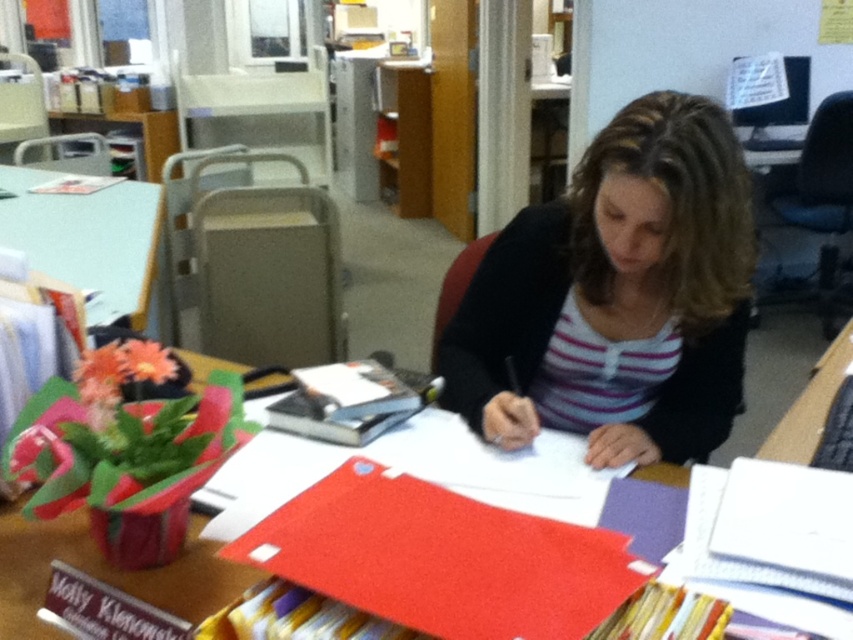
Question: Which point appears closest to the camera in this image?

Choices:
 (A) (802, 419)
 (B) (413, 380)

Answer: (A)

Question: Is the position of striped knit sweater at center less distant than that of green plastic table at upper left?

Choices:
 (A) yes
 (B) no

Answer: (A)

Question: From the image, what is the correct spatial relationship of green plastic table at upper left in relation to hardcover book at center?

Choices:
 (A) below
 (B) above

Answer: (B)

Question: Does white paper at center appear on the right side of green plastic table at upper left?

Choices:
 (A) yes
 (B) no

Answer: (A)

Question: Which of these objects is positioned closest to the hardcover book at center?

Choices:
 (A) green plastic table at upper left
 (B) white paper at center

Answer: (B)

Question: Considering the real-world distances, which object is farthest from the striped knit sweater at center?

Choices:
 (A) green plastic table at upper left
 (B) hardcover book at center

Answer: (A)